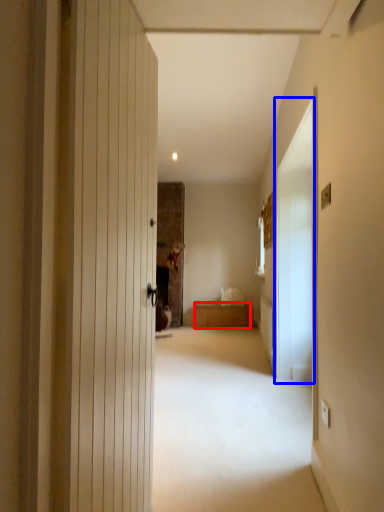
Question: Which object appears farthest to the camera in this image, furniture (highlighted by a red box) or screen door (highlighted by a blue box)?

Choices:
 (A) furniture
 (B) screen door

Answer: (A)